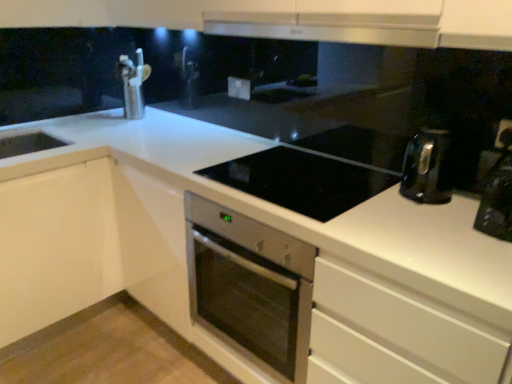
Measure the distance between point (216, 179) and camera.

They are 1.55 meters apart.

The width and height of the screenshot is (512, 384). Describe the element at coordinates (498, 189) in the screenshot. I see `black glossy coffee machine at right` at that location.

The image size is (512, 384). What do you see at coordinates (133, 84) in the screenshot? I see `brushed metal faucet at upper left` at bounding box center [133, 84].

Where is `black glass cooktop at center`? black glass cooktop at center is located at coordinates (301, 181).

Which of these two, brushed metal faucet at upper left or stainless steel oven at center, stands shorter?

brushed metal faucet at upper left.

Does brushed metal faucet at upper left lie behind stainless steel oven at center?

Yes, brushed metal faucet at upper left is further from the camera.

Between brushed metal faucet at upper left and stainless steel oven at center, which one has smaller size?

A: brushed metal faucet at upper left.

Does satin silver exhaust hood at upper center come in front of black glossy coffee machine at right?

No, the depth of satin silver exhaust hood at upper center is greater than that of black glossy coffee machine at right.

Does point (233, 35) appear closer or farther from the camera than point (486, 207)?

Clearly, point (233, 35) is more distant from the camera than point (486, 207).

Is satin silver exhaust hood at upper center taller than black glossy coffee machine at right?

No.

Is satin silver exhaust hood at upper center beside black glossy coffee machine at right?

satin silver exhaust hood at upper center and black glossy coffee machine at right are clearly separated.

Is black glass cooktop at center taller than brushed metal faucet at upper left?

No, black glass cooktop at center is not taller than brushed metal faucet at upper left.

From a real-world perspective, is black glass cooktop at center physically located above or below brushed metal faucet at upper left?

black glass cooktop at center is below brushed metal faucet at upper left.

How many degrees apart are the facing directions of black glass cooktop at center and brushed metal faucet at upper left?

4.04 degrees.

Is black glass cooktop at center looking in the opposite direction of brushed metal faucet at upper left?

No, brushed metal faucet at upper left is not at the back of black glass cooktop at center.

From a real-world perspective, who is located lower, white plastic electric outlet at center, the 2th electric outlet viewed from the front, or white plastic electric outlet at upper center, the 2th electric outlet when ordered from back to front?

white plastic electric outlet at center, the 2th electric outlet viewed from the front.

From the image's perspective, does white plastic electric outlet at center, the 2th electric outlet viewed from the front, appear higher than white plastic electric outlet at upper center, acting as the first electric outlet starting from the bottom?

Yes, from the image's perspective, white plastic electric outlet at center, the 2th electric outlet viewed from the front, is on top of white plastic electric outlet at upper center, acting as the first electric outlet starting from the bottom.

How much distance is there between white plastic electric outlet at center, the 1th electric outlet viewed from the left, and white plastic electric outlet at upper center, the 2th electric outlet positioned from the left?

white plastic electric outlet at center, the 1th electric outlet viewed from the left, and white plastic electric outlet at upper center, the 2th electric outlet positioned from the left, are 3.69 feet apart from each other.

Is white plastic electric outlet at center, the first electric outlet positioned from the top, facing towards white plastic electric outlet at upper center, positioned as the first electric outlet in right-to-left order?

No, white plastic electric outlet at center, the first electric outlet positioned from the top, is not facing towards white plastic electric outlet at upper center, positioned as the first electric outlet in right-to-left order.

From the image's perspective, would you say brushed metal faucet at upper left is positioned over black glossy coffee machine at right?

Yes.

From a real-world perspective, is brushed metal faucet at upper left located higher than black glossy coffee machine at right?

Yes, from a real-world perspective, brushed metal faucet at upper left is on top of black glossy coffee machine at right.

What are the coordinates of `appliance lying above the black glossy coffee machine at right (from the image's perspective)` in the screenshot? It's located at (133, 84).

Is the depth of brushed metal faucet at upper left greater than that of black glossy coffee machine at right?

Yes, it is behind black glossy coffee machine at right.

Between stainless steel oven at center and satin silver exhaust hood at upper center, which one appears on the left side from the viewer's perspective?

stainless steel oven at center.

Considering the sizes of stainless steel oven at center and satin silver exhaust hood at upper center in the image, is stainless steel oven at center wider or thinner than satin silver exhaust hood at upper center?

Clearly, stainless steel oven at center has more width compared to satin silver exhaust hood at upper center.

Is stainless steel oven at center turned away from satin silver exhaust hood at upper center?

No.

Consider the image. Is the position of stainless steel oven at center more distant than that of satin silver exhaust hood at upper center?

Yes, it is behind satin silver exhaust hood at upper center.

Considering the sizes of stainless steel oven at center and black glossy coffee machine at right in the image, is stainless steel oven at center bigger or smaller than black glossy coffee machine at right?

Clearly, stainless steel oven at center is larger in size than black glossy coffee machine at right.

From a real-world perspective, is stainless steel oven at center physically below black glossy coffee machine at right?

Yes, from a real-world perspective, stainless steel oven at center is below black glossy coffee machine at right.

Is stainless steel oven at center taller than black glossy coffee machine at right?

Yes, stainless steel oven at center is taller than black glossy coffee machine at right.

Can you confirm if stainless steel oven at center is thinner than black glossy coffee machine at right?

No, stainless steel oven at center is not thinner than black glossy coffee machine at right.

Locate an element on the screen. The width and height of the screenshot is (512, 384). home appliance that appears below the brushed metal faucet at upper left (from the image's perspective) is located at coordinates (250, 286).

The height and width of the screenshot is (384, 512). What are the coordinates of `exhaust hood behind the black glossy coffee machine at right` in the screenshot? It's located at (337, 22).

Looking at the image, which one is located closer to satin silver exhaust hood at upper center, brushed metal faucet at upper left or stainless steel oven at center?

The object closer to satin silver exhaust hood at upper center is stainless steel oven at center.

Considering their positions, is black glass cooktop at center positioned further to stainless steel oven at center than white plastic electric outlet at upper center, which is the second electric outlet from top to bottom?

white plastic electric outlet at upper center, which is the second electric outlet from top to bottom, lies further to stainless steel oven at center than the other object.

Considering their positions, is white plastic electric outlet at center, which is counted as the 2th electric outlet, starting from the bottom, positioned further to black glossy coffee machine at right than stainless steel oven at center?

The object further to black glossy coffee machine at right is white plastic electric outlet at center, which is counted as the 2th electric outlet, starting from the bottom.

From the image, which object appears to be nearer to white plastic electric outlet at center, the first electric outlet positioned from the top, black glass cooktop at center or white plastic electric outlet at upper center, positioned as the first electric outlet in right-to-left order?

black glass cooktop at center.

Estimate the real-world distances between objects in this image. Which object is closer to black glass cooktop at center, stainless steel oven at center or white plastic electric outlet at center, the first electric outlet positioned from the top?

The object closer to black glass cooktop at center is stainless steel oven at center.

Based on their spatial positions, is white plastic electric outlet at upper center, which is the second electric outlet from top to bottom, or black glass cooktop at center closer to black glossy coffee machine at right?

The object closer to black glossy coffee machine at right is white plastic electric outlet at upper center, which is the second electric outlet from top to bottom.

Based on the photo, considering their positions, is brushed metal faucet at upper left positioned closer to white plastic electric outlet at upper center, acting as the first electric outlet starting from the bottom, than black glossy coffee machine at right?

black glossy coffee machine at right.

When comparing their distances from brushed metal faucet at upper left, does white plastic electric outlet at center, which is counted as the 2th electric outlet, starting from the bottom, or stainless steel oven at center seem closer?

Based on the image, white plastic electric outlet at center, which is counted as the 2th electric outlet, starting from the bottom, appears to be nearer to brushed metal faucet at upper left.

The height and width of the screenshot is (384, 512). I want to click on gas stove between stainless steel oven at center and white plastic electric outlet at upper center, the 2th electric outlet positioned from the left, in the horizontal direction, so click(301, 181).

Find the location of `home appliance between satin silver exhaust hood at upper center and white plastic electric outlet at center, the first electric outlet positioned from the top, from front to back`. home appliance between satin silver exhaust hood at upper center and white plastic electric outlet at center, the first electric outlet positioned from the top, from front to back is located at coordinates (250, 286).

I want to click on home appliance located between white plastic electric outlet at center, marked as the first electric outlet in a back-to-front arrangement, and white plastic electric outlet at upper center, the 2th electric outlet when ordered from back to front, in the left-right direction, so click(x=250, y=286).

Locate an element on the screen. The height and width of the screenshot is (384, 512). gas stove situated between stainless steel oven at center and black glossy coffee machine at right from left to right is located at coordinates (301, 181).